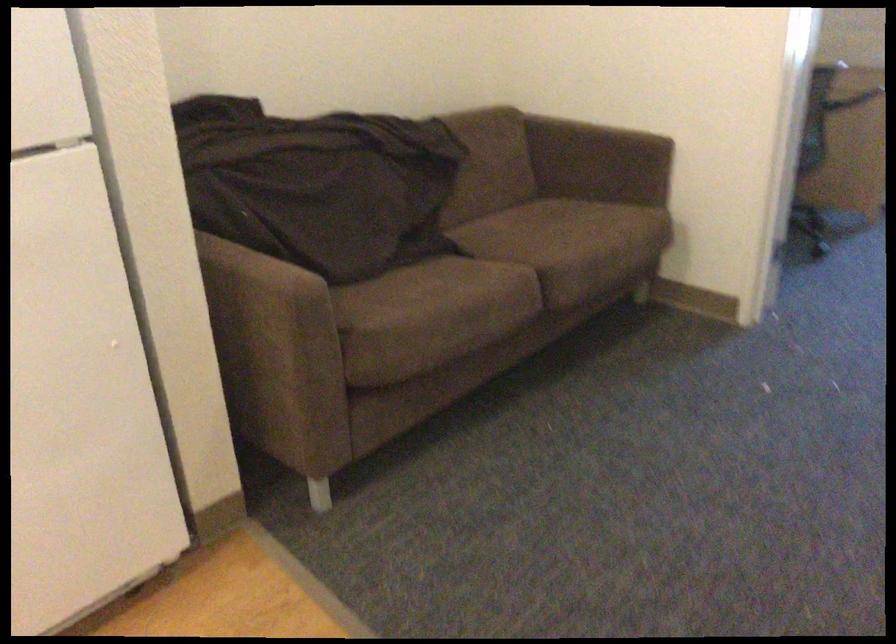
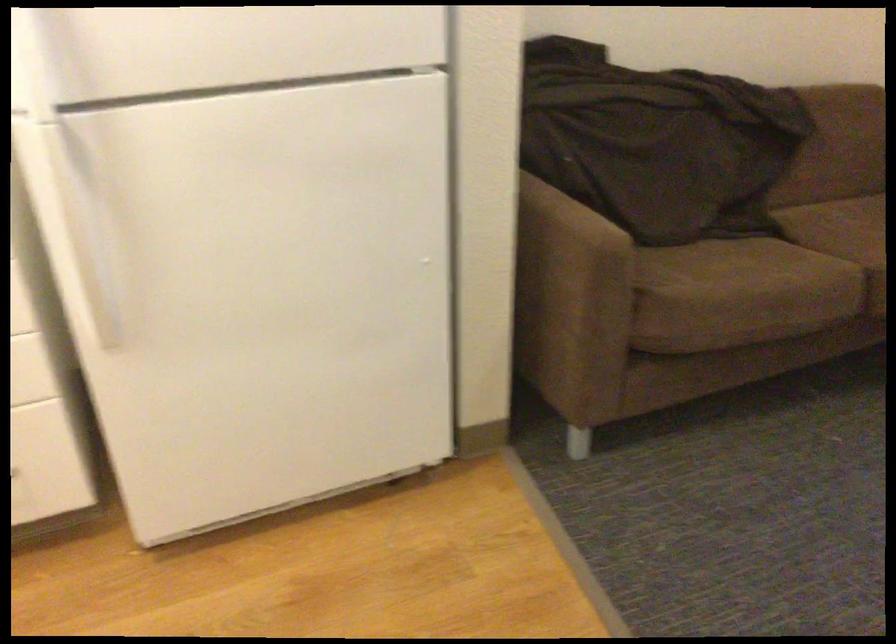
Question: The images are taken continuously from a first-person perspective. In which direction are you moving?

Choices:
 (A) Left
 (B) Right
 (C) Forward
 (D) Backward

Answer: (A)